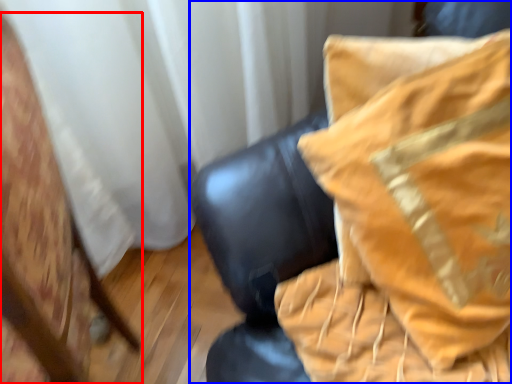
Question: Which object is further to the camera taking this photo, furniture (highlighted by a red box) or furniture (highlighted by a blue box)?

Choices:
 (A) furniture
 (B) furniture

Answer: (B)